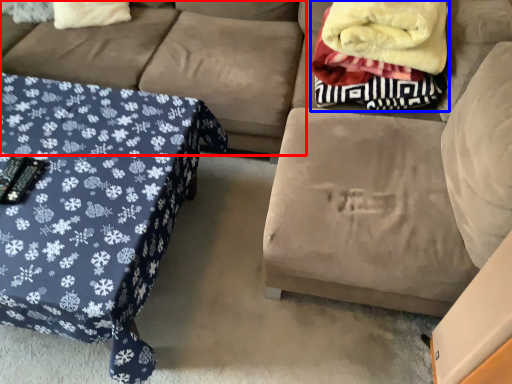
Question: Which of the following is the closest to the observer, couch (highlighted by a red box) or blanket (highlighted by a blue box)?

Choices:
 (A) couch
 (B) blanket

Answer: (B)